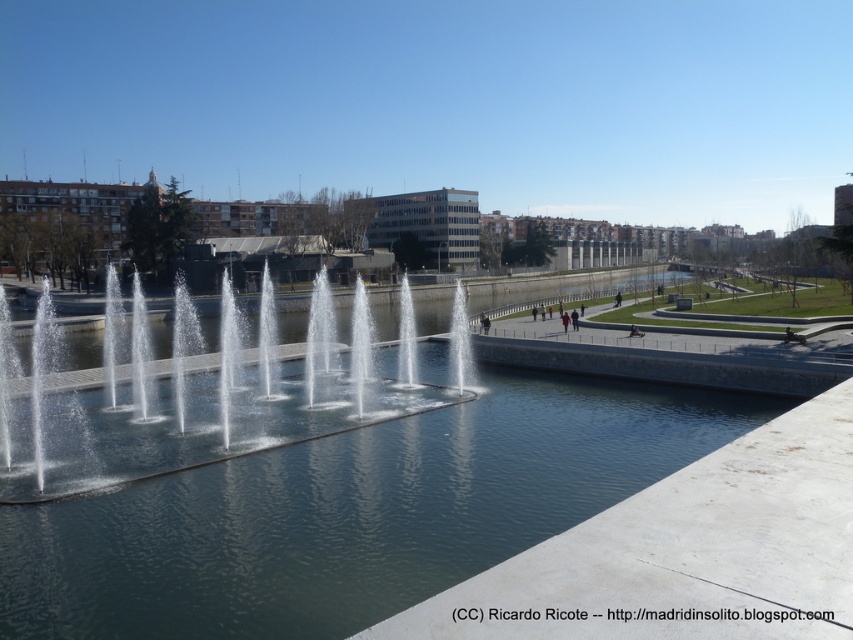
Is clear water at center wider than clear water jets at center?

Indeed, clear water at center has a greater width compared to clear water jets at center.

Where is `clear water at center`? This screenshot has width=853, height=640. clear water at center is located at coordinates (352, 513).

Image resolution: width=853 pixels, height=640 pixels. Describe the element at coordinates (352, 513) in the screenshot. I see `clear water at center` at that location.

What are the coordinates of `clear water at center` in the screenshot? It's located at (352, 513).